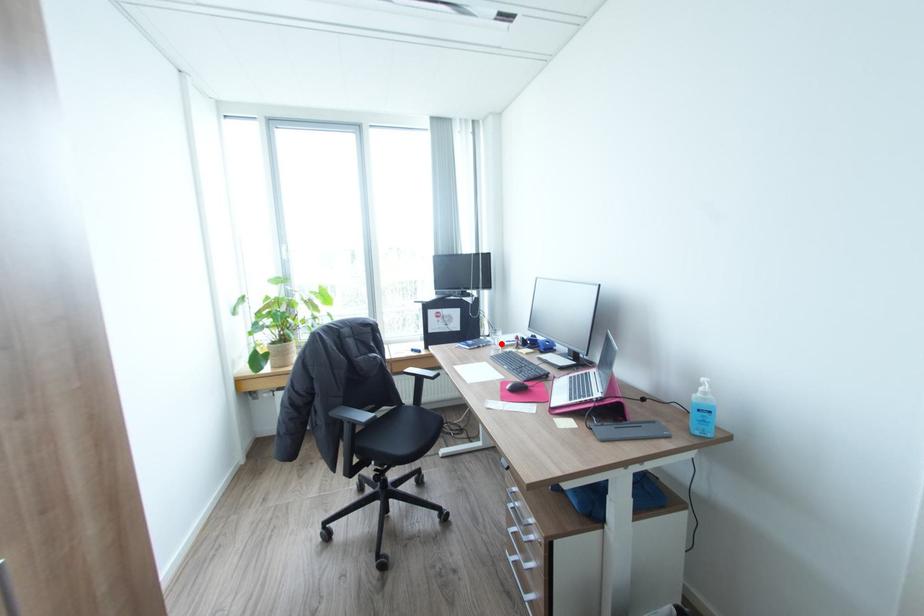
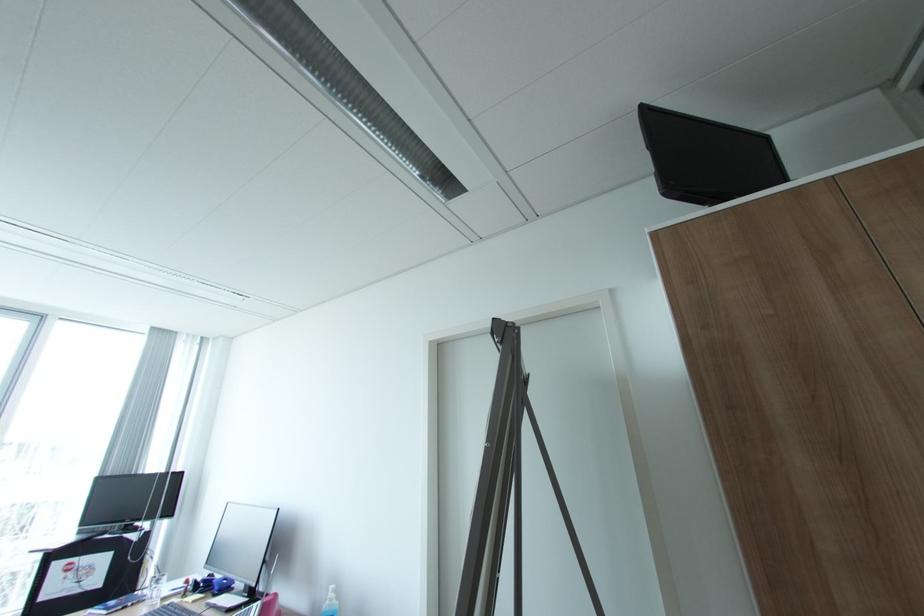
Locate, in the second image, the point that corresponds to the highlighted location in the first image.

(160, 596)